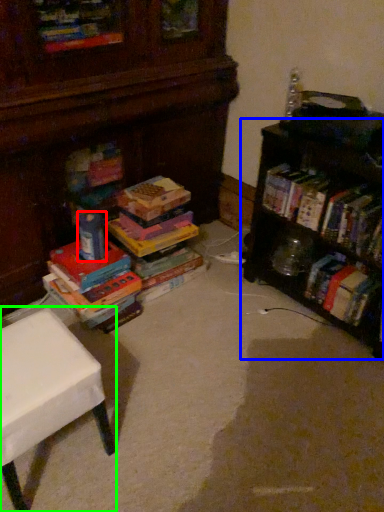
Question: Which object is the closest to the toy (highlighted by a red box)? Choose among these: shelf (highlighted by a blue box) or table (highlighted by a green box).

Choices:
 (A) shelf
 (B) table

Answer: (B)